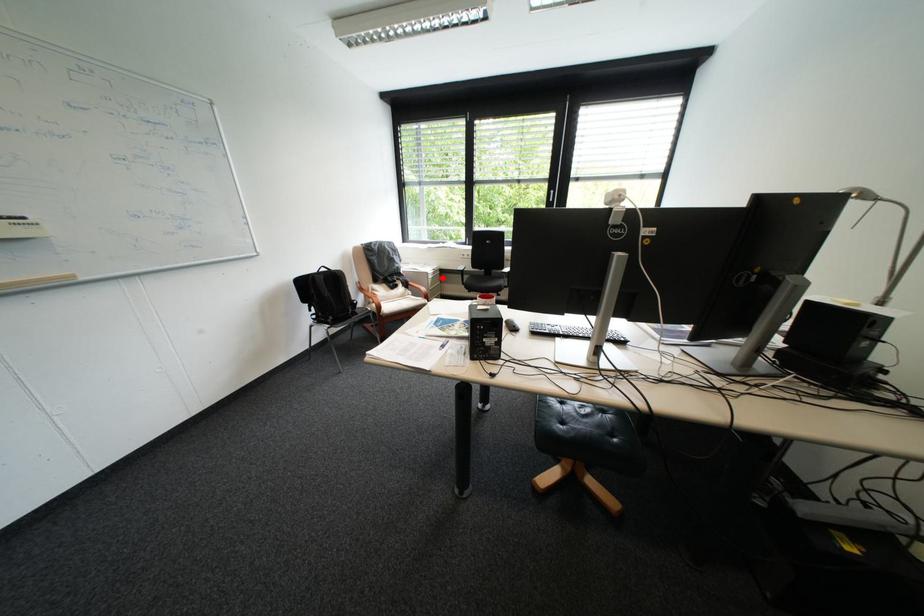
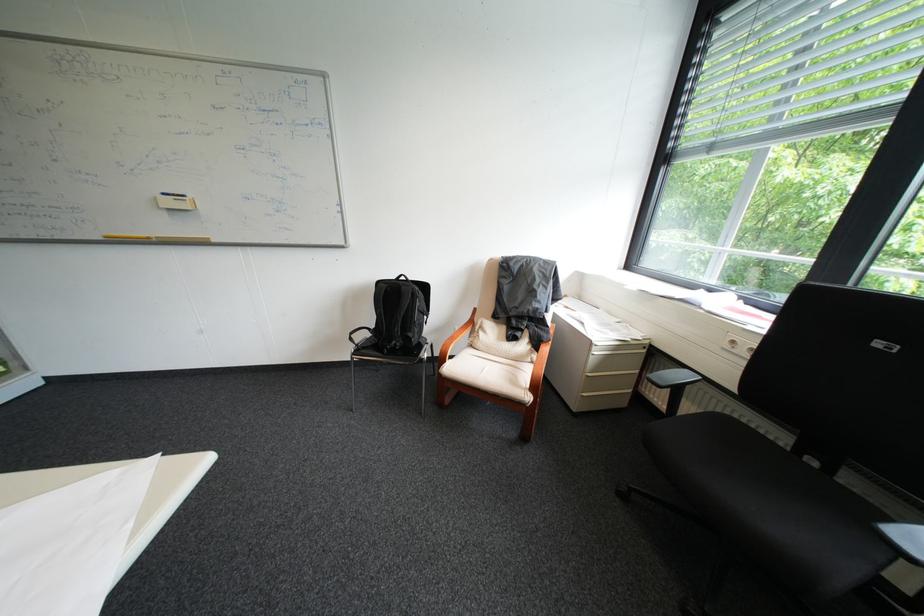
Question: A red point is marked in image1. In image2, is the corresponding 3D point closer to the camera or farther? Reply with the corresponding letter.

Choices:
 (A) The corresponding 3D point is closer.
 (B) The corresponding 3D point is farther.

Answer: (B)